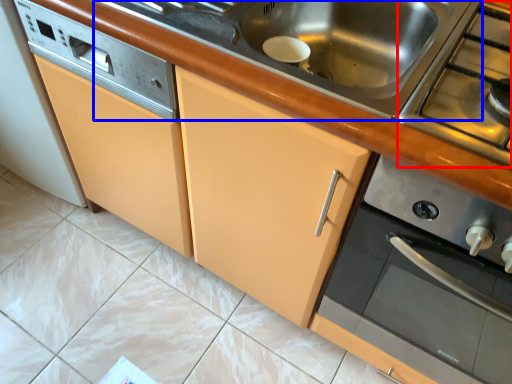
Question: Which object is closer to the camera taking this photo, gas stove (highlighted by a red box) or sink (highlighted by a blue box)?

Choices:
 (A) gas stove
 (B) sink

Answer: (A)